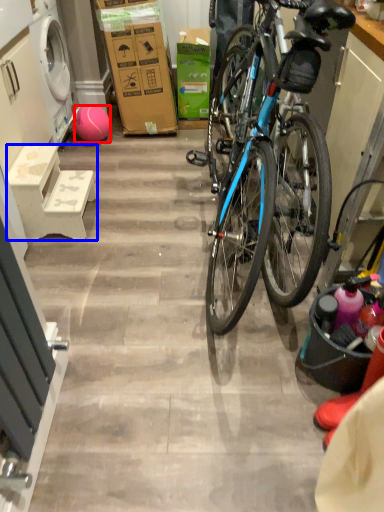
Question: Among these objects, which one is farthest to the camera, ball (highlighted by a red box) or stool (highlighted by a blue box)?

Choices:
 (A) ball
 (B) stool

Answer: (A)